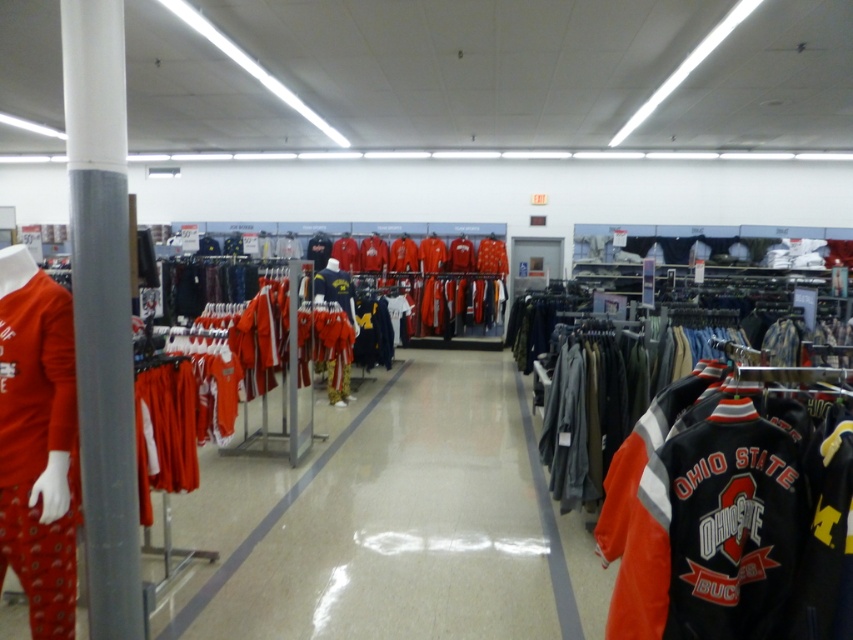
Question: Can you confirm if white glossy pole at left is positioned above orange fabric pants at center?

Choices:
 (A) yes
 (B) no

Answer: (A)

Question: Considering the real-world distances, which object is closest to the matte orange sweatshirt at left?

Choices:
 (A) matte gold sweatshirt at center
 (B) white glossy pole at left
 (C) orange leather jacket at right

Answer: (B)

Question: Which point is closer to the camera?

Choices:
 (A) (35, 369)
 (B) (445, 432)
 (C) (135, 614)

Answer: (A)

Question: Among these points, which one is nearest to the camera?

Choices:
 (A) (x=332, y=388)
 (B) (x=701, y=433)

Answer: (B)

Question: Can you confirm if white glossy pole at left is positioned above orange fabric pants at center?

Choices:
 (A) yes
 (B) no

Answer: (A)

Question: Is matte orange sweatshirt at left wider than orange fabric pants at center?

Choices:
 (A) yes
 (B) no

Answer: (A)